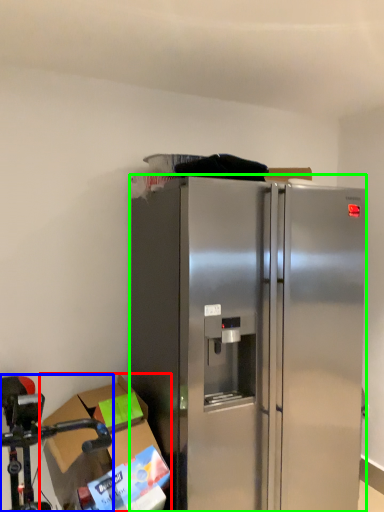
Question: Based on their relative distances, which object is farther from cardboard box (highlighted by a red box)? Choose from stainless steel (highlighted by a blue box) and refrigerator (highlighted by a green box).

Choices:
 (A) stainless steel
 (B) refrigerator

Answer: (B)